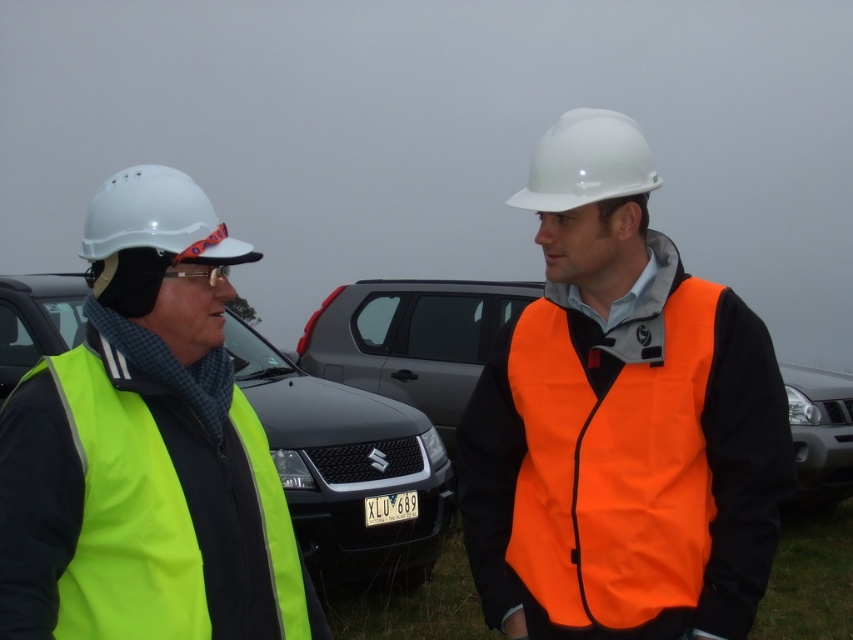
Question: Which point appears closest to the camera in this image?

Choices:
 (A) (552, 125)
 (B) (265, 387)
 (C) (827, 488)
 (D) (187, 276)

Answer: (D)

Question: Can you confirm if orange fabric safety vest at center is bigger than white hard hat at center?

Choices:
 (A) yes
 (B) no

Answer: (A)

Question: Which of the following is the farthest from the observer?

Choices:
 (A) (363, 579)
 (B) (119, 244)
 (C) (764, 513)
 (D) (665, 570)

Answer: (A)

Question: Where is white hard hat at center located in relation to silver metallic suv at right in the image?

Choices:
 (A) right
 (B) left

Answer: (B)

Question: Does matte orange safety vest at center have a larger size compared to clear plastic goggles at center?

Choices:
 (A) yes
 (B) no

Answer: (A)

Question: Which object is closer to the camera taking this photo?

Choices:
 (A) clear plastic goggles at center
 (B) orange fabric safety vest at center
 (C) white hard hat at left
 (D) matte orange safety vest at center

Answer: (C)